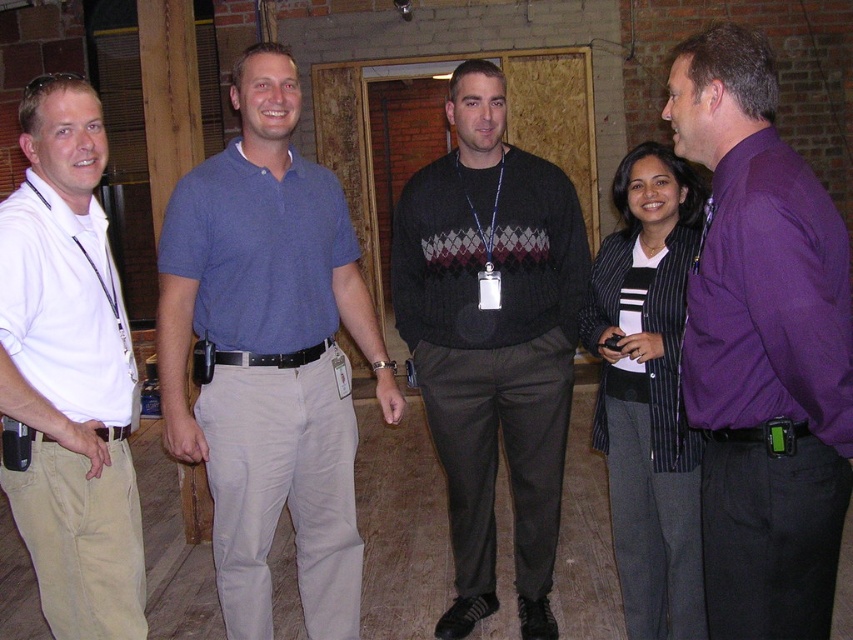
Between point (759, 544) and point (657, 296), which one is positioned behind?

The point (657, 296) is behind.

This screenshot has width=853, height=640. I want to click on purple shirt at right, so click(x=762, y=349).

Is point (701, 368) closer to camera compared to point (15, 397)?

Yes, point (701, 368) is in front of point (15, 397).

The image size is (853, 640). Identify the location of purple shirt at right. (762, 349).

Can you confirm if dark gray sweater at center is positioned to the left of striped blazer at center?

Yes, dark gray sweater at center is to the left of striped blazer at center.

Does dark gray sweater at center have a smaller size compared to striped blazer at center?

No.

Locate an element on the screen. This screenshot has height=640, width=853. dark gray sweater at center is located at coordinates (492, 340).

Identify the location of dark gray sweater at center. (492, 340).